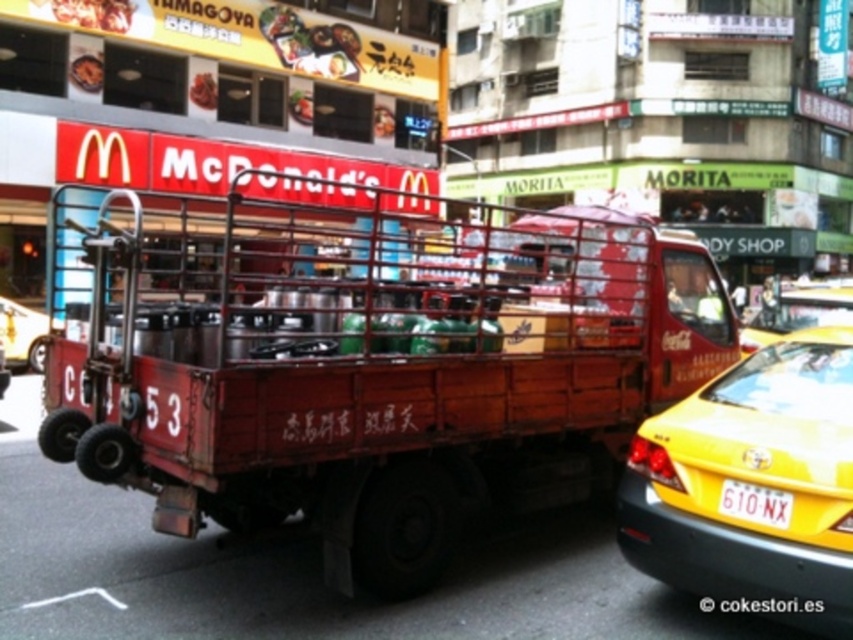
Which is in front, point (850, 385) or point (734, 512)?

Point (734, 512) is more forward.

Does yellow matte taxi at right have a smaller size compared to yellow plastic license plate at lower right?

No.

What do you see at coordinates (752, 483) in the screenshot? I see `yellow matte taxi at right` at bounding box center [752, 483].

Where is `yellow matte taxi at right`? This screenshot has height=640, width=853. yellow matte taxi at right is located at coordinates (752, 483).

Does metallic silver car at left have a lesser width compared to yellow plastic license plate at lower right?

In fact, metallic silver car at left might be wider than yellow plastic license plate at lower right.

Does point (22, 305) come in front of point (764, 490)?

No, (22, 305) is further to viewer.

Does point (39, 332) lie in front of point (763, 499)?

No, it is not.

At what (x,y) coordinates should I click in order to perform the action: click on metallic silver car at left. Please return your answer as a coordinate pair (x, y). The width and height of the screenshot is (853, 640). Looking at the image, I should click on (22, 333).

Is point (349, 419) more distant than point (762, 512)?

That is True.

Between rusty metal truck at center and yellow plastic license plate at lower right, which one is positioned lower?

yellow plastic license plate at lower right is below.

This screenshot has height=640, width=853. What do you see at coordinates (370, 368) in the screenshot? I see `rusty metal truck at center` at bounding box center [370, 368].

Image resolution: width=853 pixels, height=640 pixels. Find the location of `rusty metal truck at center`. rusty metal truck at center is located at coordinates (370, 368).